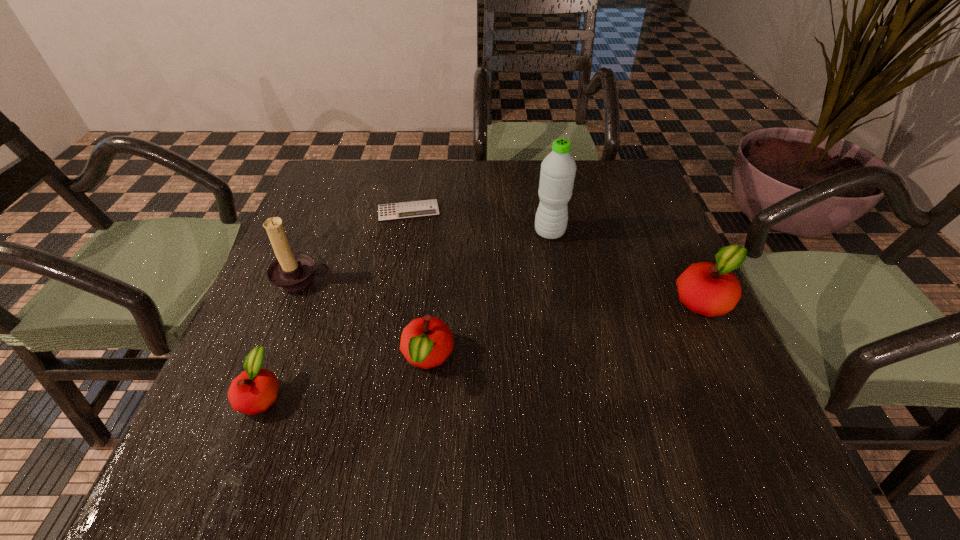
Where is `apple that is the third closest to the farthest object`? The width and height of the screenshot is (960, 540). apple that is the third closest to the farthest object is located at coordinates (709, 289).

Where is `apple that is the third closest to the second tallest object`? Image resolution: width=960 pixels, height=540 pixels. apple that is the third closest to the second tallest object is located at coordinates click(709, 289).

At what (x,y) coordinates should I click in order to perform the action: click on vacant space that satisfies the following two spatial constraints: 1. on the wick of the third shortest object; 2. on the left side of the candle holder. Please return your answer as a coordinate pair (x, y). This screenshot has width=960, height=540. Looking at the image, I should click on (270, 358).

Image resolution: width=960 pixels, height=540 pixels. What are the coordinates of `free space that satisfies the following two spatial constraints: 1. on the back side of the second shortest object; 2. on the left side of the fourth tallest object` in the screenshot? It's located at [276, 358].